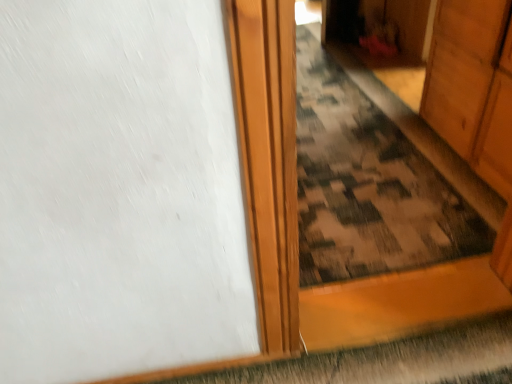
What do you see at coordinates (371, 181) in the screenshot?
I see `camouflage fabric doormat at center` at bounding box center [371, 181].

Image resolution: width=512 pixels, height=384 pixels. What are the coordinates of `camouflage fabric doormat at center` in the screenshot? It's located at (371, 181).

The image size is (512, 384). What are the coordinates of `camouflage fabric doormat at center` in the screenshot? It's located at (371, 181).